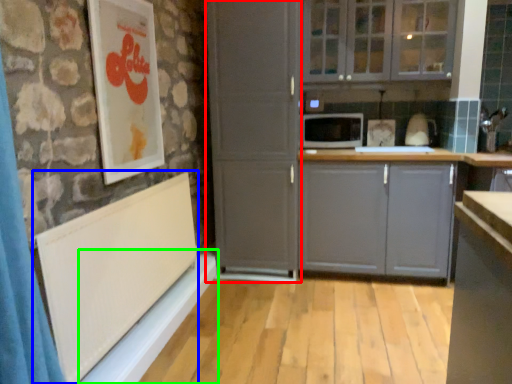
Question: Estimate the real-world distances between objects in this image. Which object is farther from screen door (highlighted by a red box), bulletin board (highlighted by a blue box) or window sill (highlighted by a green box)?

Choices:
 (A) bulletin board
 (B) window sill

Answer: (A)